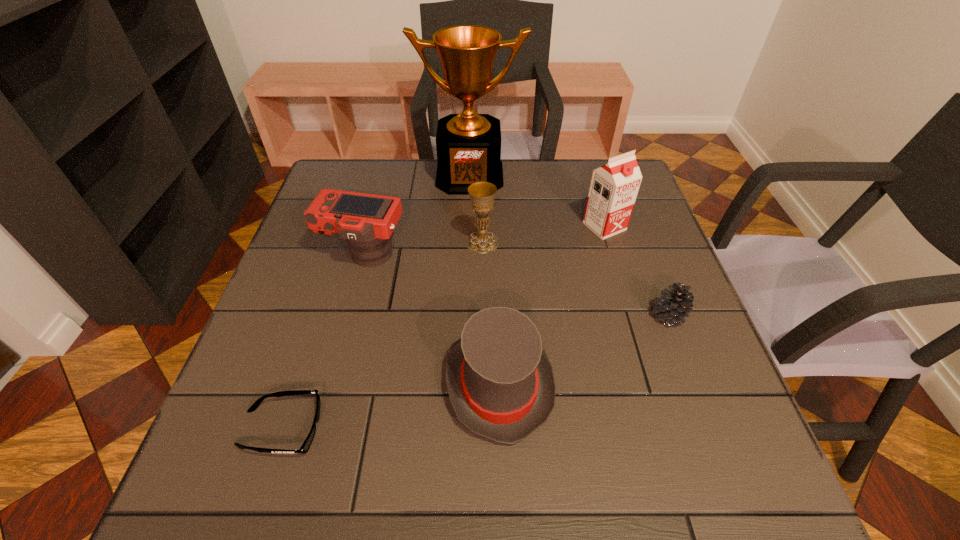
Where is `the tallest object`? Image resolution: width=960 pixels, height=540 pixels. the tallest object is located at coordinates (468, 145).

This screenshot has width=960, height=540. Find the location of `the farthest object`. the farthest object is located at coordinates (468, 145).

Locate an element on the screen. This screenshot has height=540, width=960. soya milk is located at coordinates pyautogui.click(x=614, y=186).

Image resolution: width=960 pixels, height=540 pixels. What are the coordinates of `chalice` in the screenshot? It's located at (482, 194).

Locate an element on the screen. camera is located at coordinates (366, 221).

Locate an element on the screen. Image resolution: width=960 pixels, height=540 pixels. dress hat is located at coordinates (500, 382).

Locate an element on the screen. This screenshot has height=540, width=960. the third nearest object is located at coordinates (674, 305).

You are a GUI agent. You are given a task and a screenshot of the screen. Output one action in this format:
    pyautogui.click(x=<x>, y=<y>)
    Task: Click on the pinecone
    The image size is (960, 540).
    Given the screenshot: What is the action you would take?
    pyautogui.click(x=674, y=305)

Image resolution: width=960 pixels, height=540 pixels. I want to click on sunglasses, so click(x=304, y=448).

Locate an element on the screen. The width and height of the screenshot is (960, 540). vacant area situated on the front of the tallest object with the label is located at coordinates (468, 217).